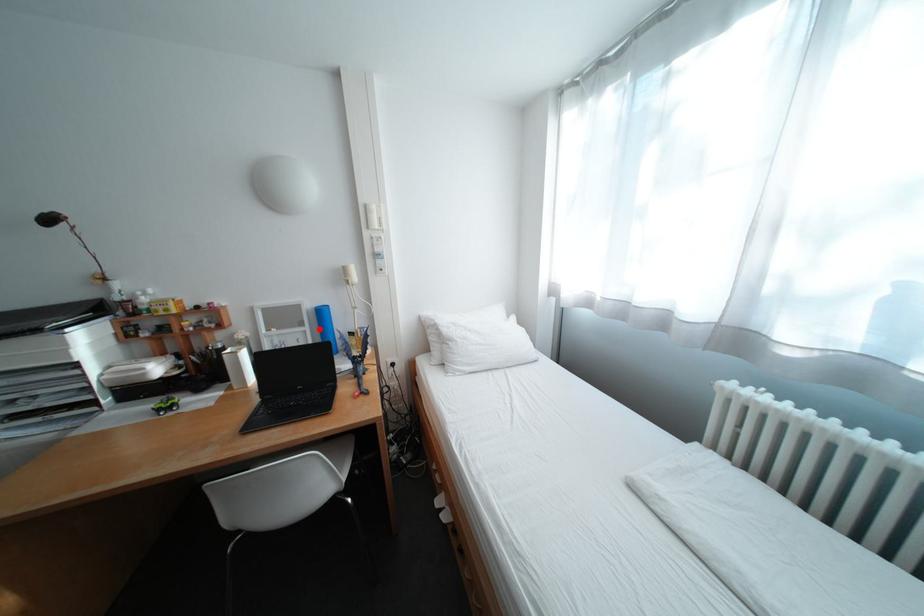
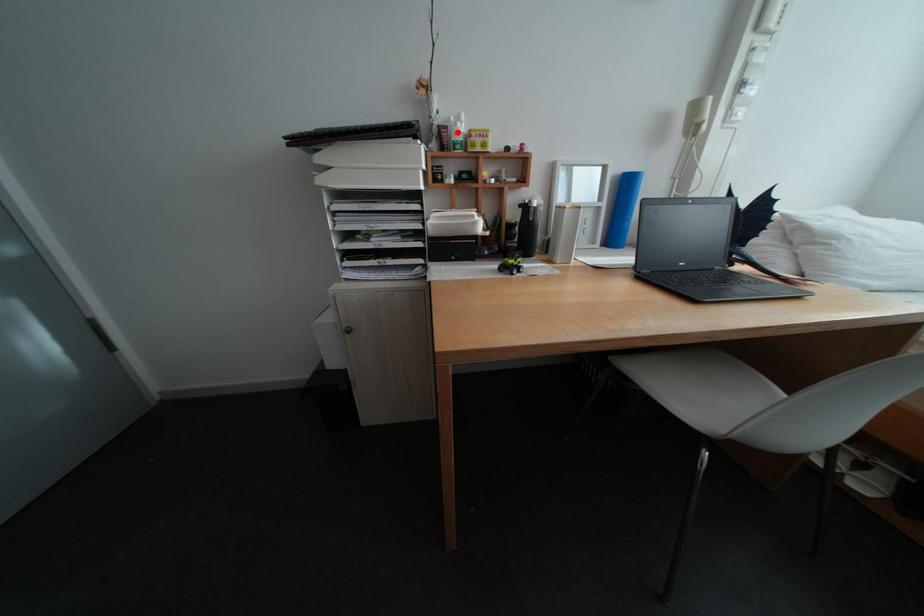
I am providing you with two images of the same scene from different viewpoints. A red point is marked on the first image and another point is marked on the second image. Do the highlighted points in image1 and image2 indicate the same real-world spot?

No